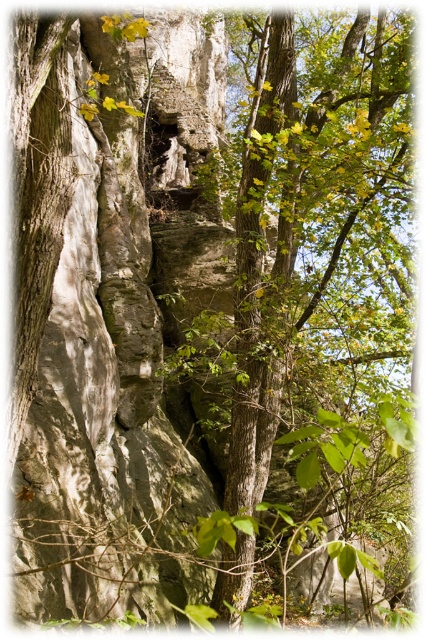
Question: Which point appears closest to the camera in this image?

Choices:
 (A) (409, 129)
 (B) (293, 193)

Answer: (B)

Question: Which point is closer to the camera taking this photo?

Choices:
 (A) (291, 120)
 (B) (265, 486)

Answer: (A)

Question: Can you confirm if green leafy tree at center is positioned below green rough bark tree trunk at center?

Choices:
 (A) yes
 (B) no

Answer: (B)

Question: Is green leafy tree at center above green rough bark tree trunk at center?

Choices:
 (A) yes
 (B) no

Answer: (A)

Question: Is green leafy tree at center in front of green rough bark tree trunk at center?

Choices:
 (A) no
 (B) yes

Answer: (B)